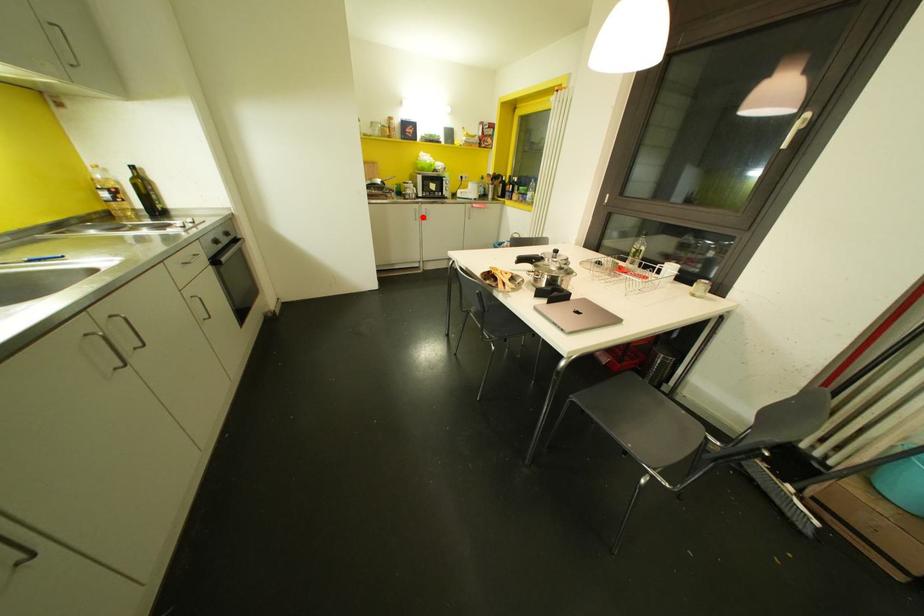
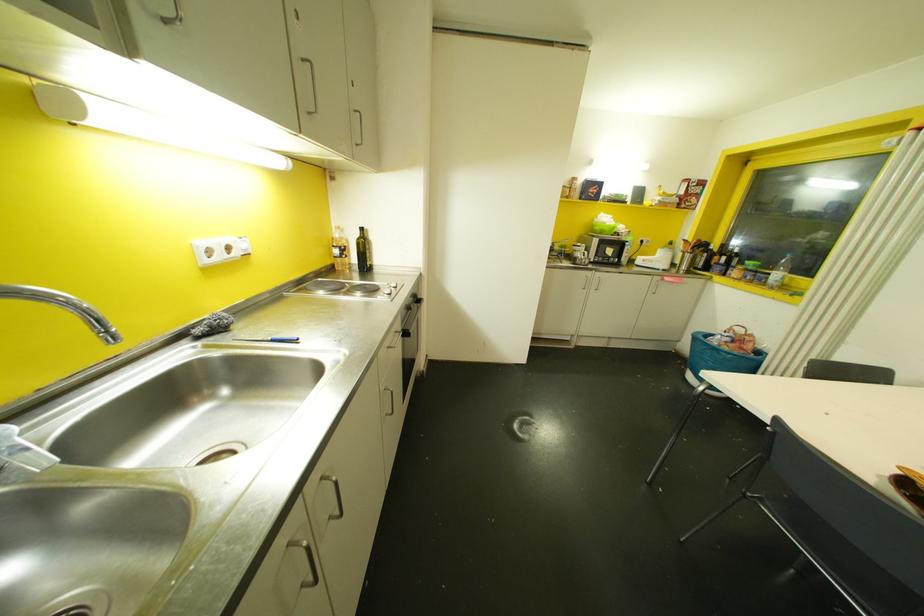
The point at the highlighted location is marked in the first image. Where is the corresponding point in the second image?

(592, 286)